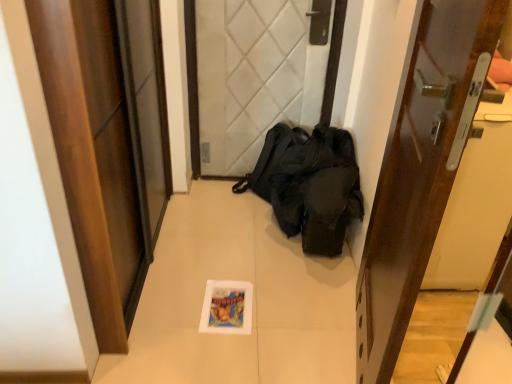
I want to click on empty space that is in between wooden door at left, which appears as the 3th door when viewed from the right, and wooden glossy door at right, the 1th door positioned from the right, so click(241, 292).